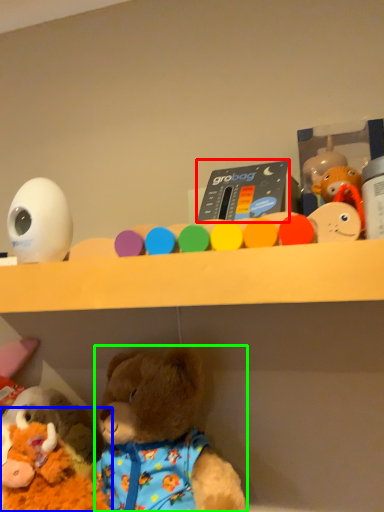
Question: Which object is the closest to the toy (highlighted by a red box)? Choose among these: toy (highlighted by a blue box) or teddy bear (highlighted by a green box).

Choices:
 (A) toy
 (B) teddy bear

Answer: (B)